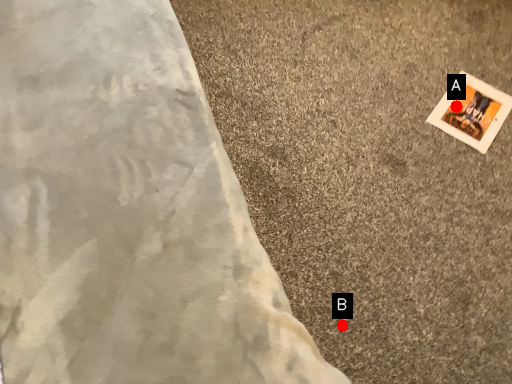
Question: Two points are circled on the image, labeled by A and B beside each circle. Which point appears farthest from the camera in this image?

Choices:
 (A) A is further
 (B) B is further

Answer: (A)